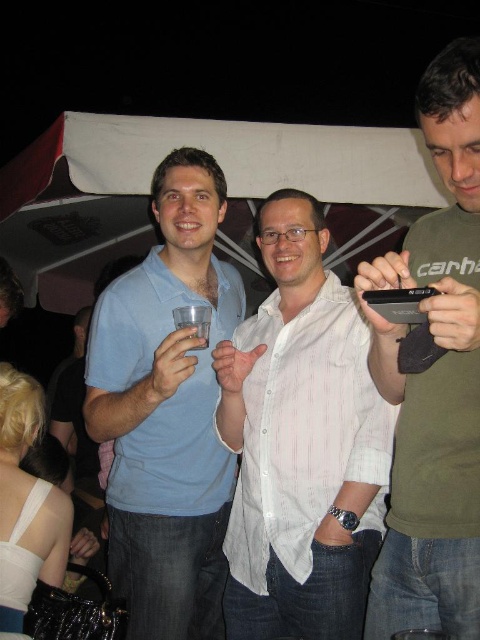
Question: Is green matte shirt at center closer to camera compared to clear plastic cup at center?

Choices:
 (A) no
 (B) yes

Answer: (B)

Question: Among these points, which one is nearest to the camera?

Choices:
 (A) (197, 336)
 (B) (208, 525)
 (C) (450, 106)
 (D) (340, 593)

Answer: (C)

Question: Is white striped shirt at center behind clear plastic cup at center?

Choices:
 (A) no
 (B) yes

Answer: (B)

Question: Is green matte shirt at center to the left of clear plastic cup at center from the viewer's perspective?

Choices:
 (A) yes
 (B) no

Answer: (B)

Question: Which of the following is the farthest from the observer?

Choices:
 (A) (120, 509)
 (B) (196, 333)
 (C) (348, 355)
 (D) (386, 260)

Answer: (A)

Question: Which point appears farthest from the camera in this image?

Choices:
 (A) (160, 579)
 (B) (261, 470)

Answer: (A)